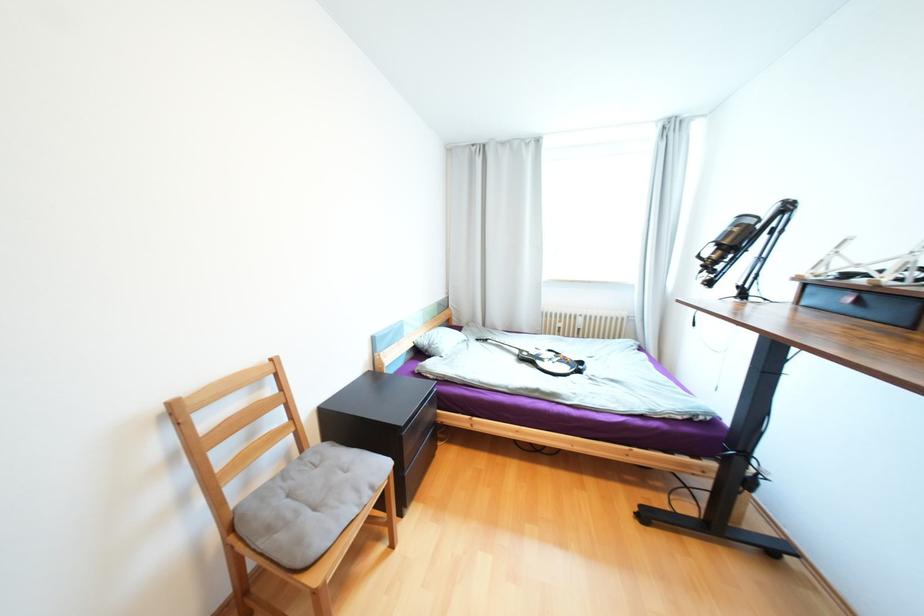
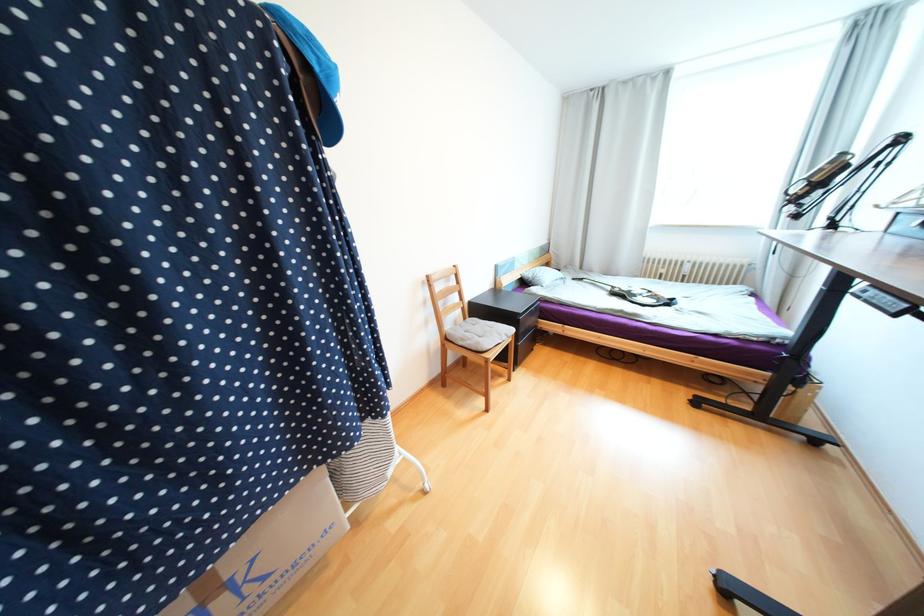
In the second image, find the point that corresponds to point 363,492 in the first image.

(505, 334)